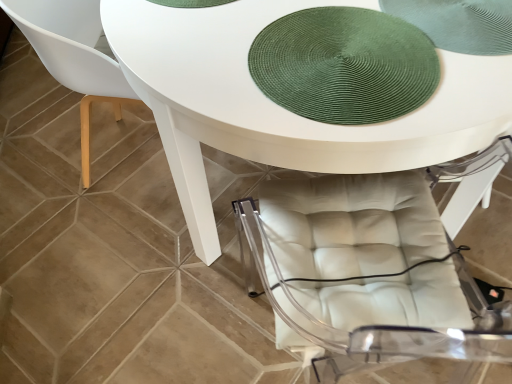
Identify the location of vacant area situated to the left side of green woven mat at upper center. (190, 52).